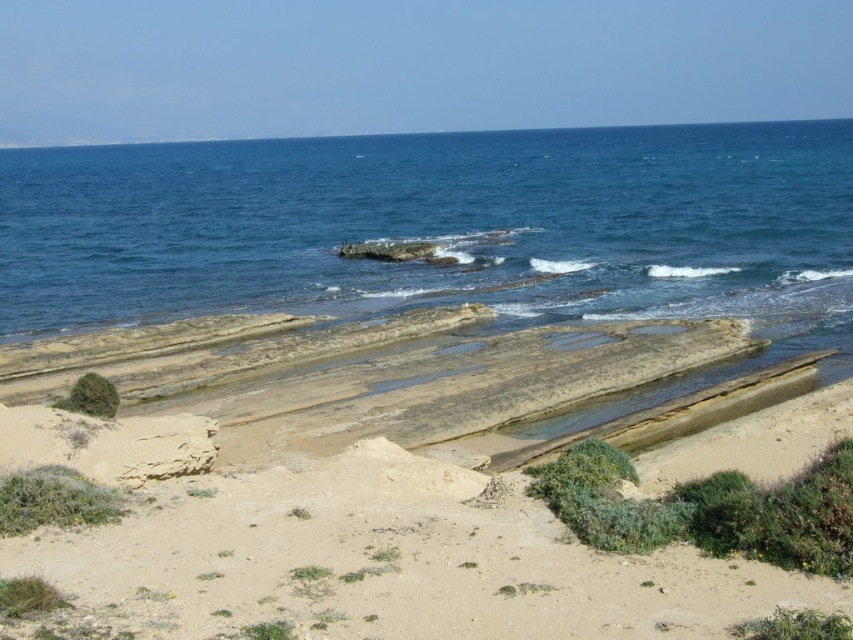
You are standing on the brown sandy beach at lower center and want to reach the blue water at center. Based on the scene, which direction should you move to get to the water?

The blue water at center is taller than the brown sandy beach at lower center, so you should move towards the direction where the elevation increases, which would be towards the blue water at center.

You are standing on the sandy beach in the image and see the point marked at coordinates (x=440, y=228). Based on the scene description, where is this point located?

The point marked at coordinates (x=440, y=228) is located on the blue water at center, as described in the scene.